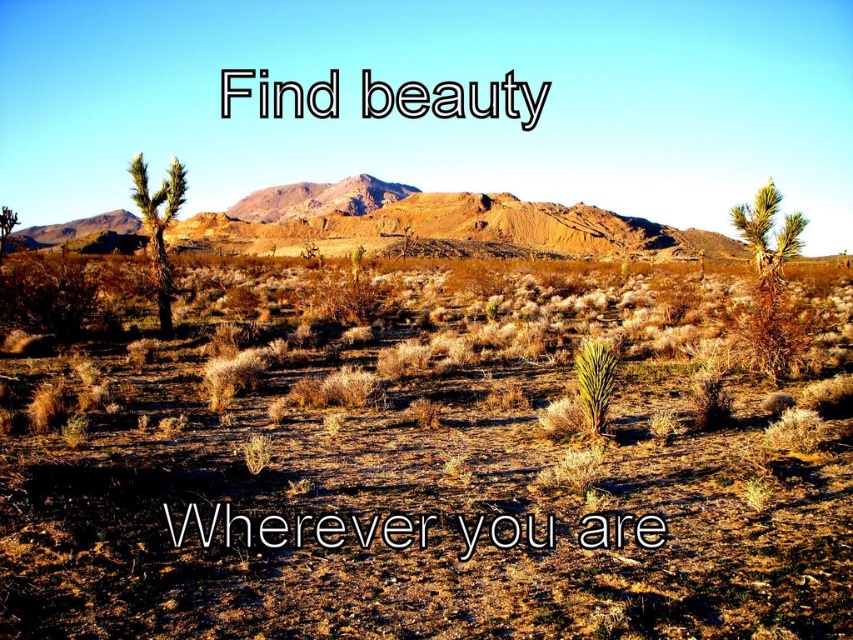
Question: Among these points, which one is nearest to the camera?

Choices:
 (A) (141, 168)
 (B) (772, 349)
 (C) (814, 492)

Answer: (C)

Question: Can you confirm if brown dry grass at center is smaller than green spiky cactus at center?

Choices:
 (A) yes
 (B) no

Answer: (B)

Question: Which point is farther to the camera?

Choices:
 (A) (163, 230)
 (B) (763, 236)

Answer: (A)

Question: Is brown rocky mountain at center positioned at the back of green spiky cactus at right?

Choices:
 (A) no
 (B) yes

Answer: (B)

Question: Which point is farther to the camera?

Choices:
 (A) (393, 490)
 (B) (44, 227)
 (C) (589, 422)
 (D) (137, 168)

Answer: (B)

Question: Can you confirm if brown dry grass at center is positioned above green spiky cactus at center?

Choices:
 (A) yes
 (B) no

Answer: (A)